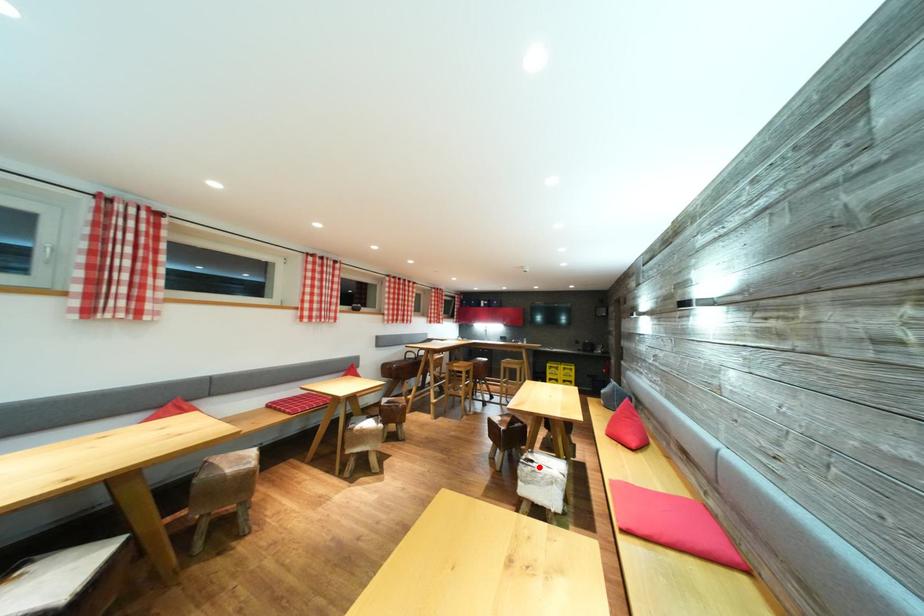
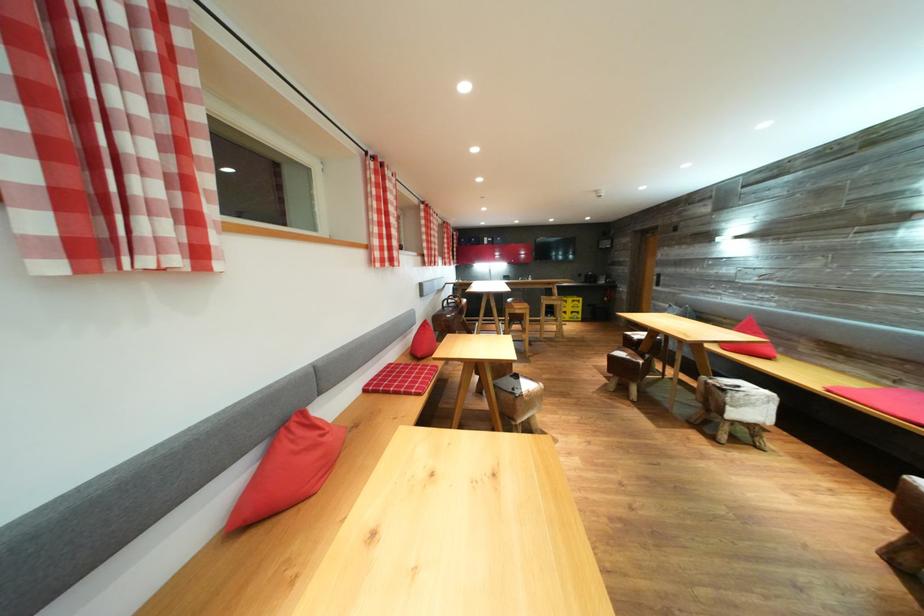
Question: A red point is marked in image1. In image2, is the corresponding 3D point closer to the camera or farther? Reply with the corresponding letter.

Choices:
 (A) The corresponding 3D point is closer.
 (B) The corresponding 3D point is farther.

Answer: (B)